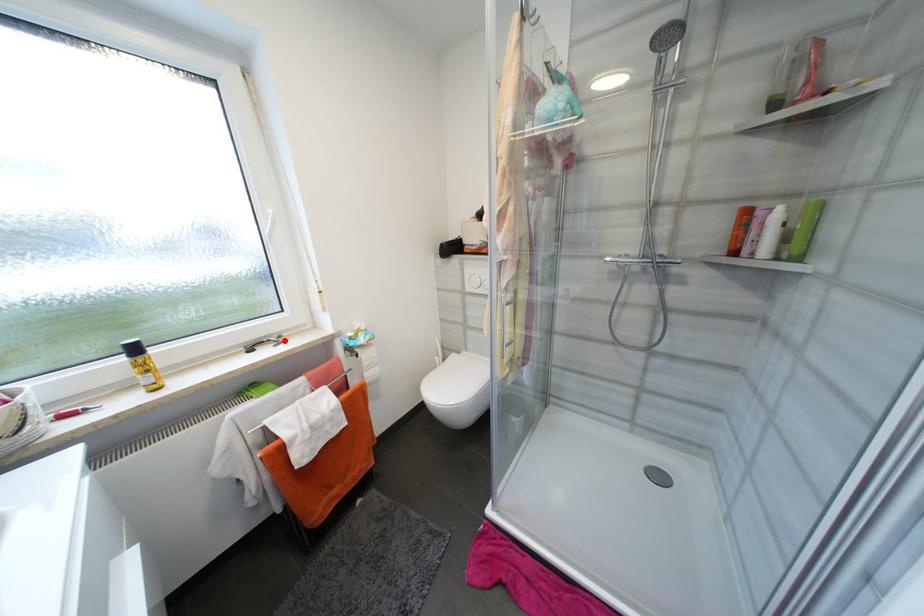
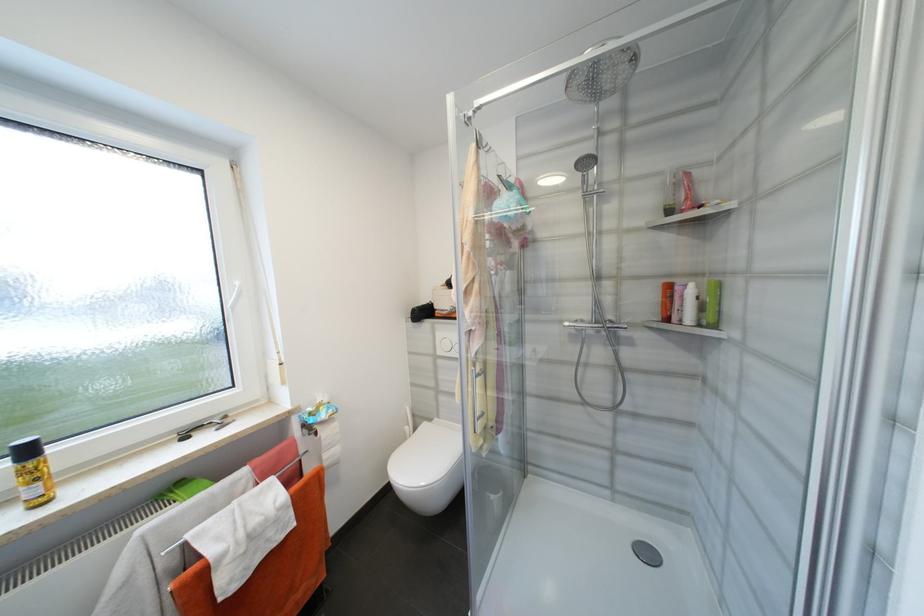
The point at the highlighted location is marked in the first image. Where is the corresponding point in the second image?

(228, 422)